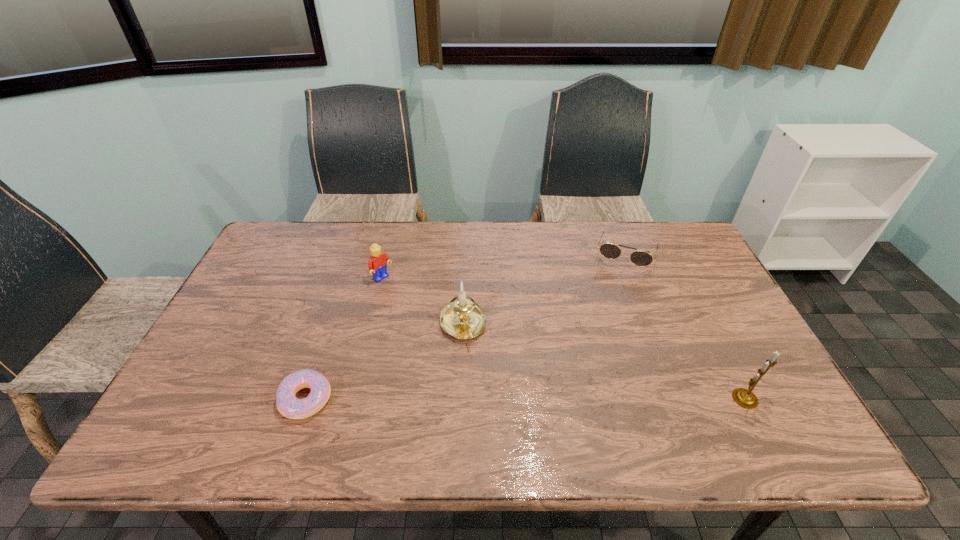
I want to click on vacant area between the farther candle holder and the Lego, so click(x=422, y=302).

At what (x,y) coordinates should I click in order to perform the action: click on object that is the second closest to the nearer candle holder. Please return your answer as a coordinate pair (x, y). Image resolution: width=960 pixels, height=540 pixels. Looking at the image, I should click on (462, 318).

Select which object is the second closest to the nearer candle holder. Please provide its 2D coordinates. Your answer should be formatted as a tuple, i.e. [(x, y)], where the tuple contains the x and y coordinates of a point satisfying the conditions above.

[(462, 318)]

This screenshot has width=960, height=540. What are the coordinates of `vacant space that satisfies the following two spatial constraints: 1. on the back side of the leftmost object; 2. on the right side of the shorter candle holder` in the screenshot? It's located at (330, 325).

Locate an element on the screen. free space that satisfies the following two spatial constraints: 1. on the back side of the sunglasses; 2. on the right side of the doughnut is located at coordinates [353, 254].

I want to click on vacant point that satisfies the following two spatial constraints: 1. on the front side of the shorter candle holder; 2. on the left side of the Lego, so click(371, 325).